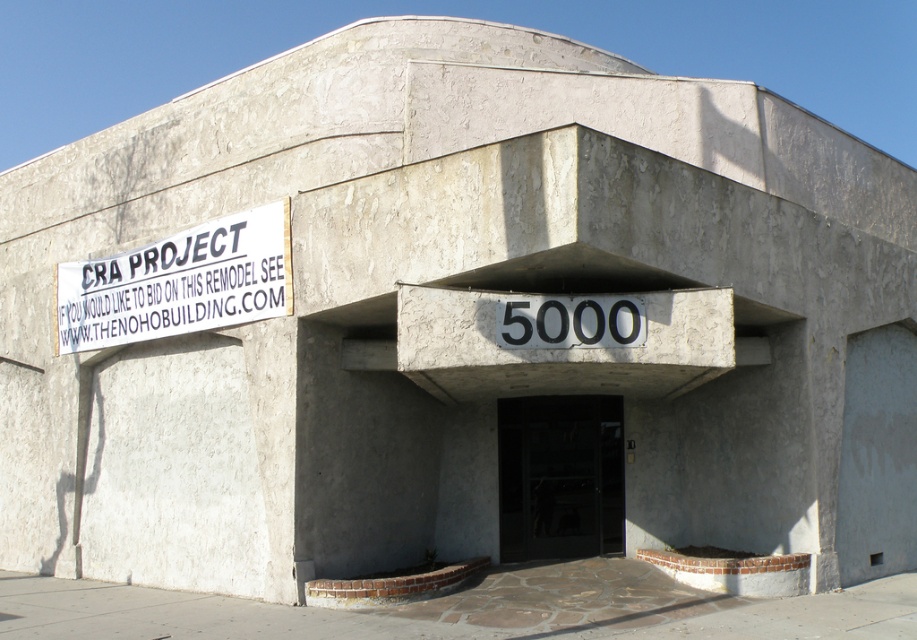
You are standing in front of a modern building with a gray concrete structure. You need to determine the distance to the gray concrete at lower center. Can you estimate how far it is from your current position?

The gray concrete at lower center is 31.01 feet away from the viewer.

You are an architect assessing the building facade. You need to determine which object occupies more horizontal space. Which one is wider between the gray concrete at lower center and the white paper sign at upper left?

The gray concrete at lower center is wider than the white paper sign at upper left according to the description.